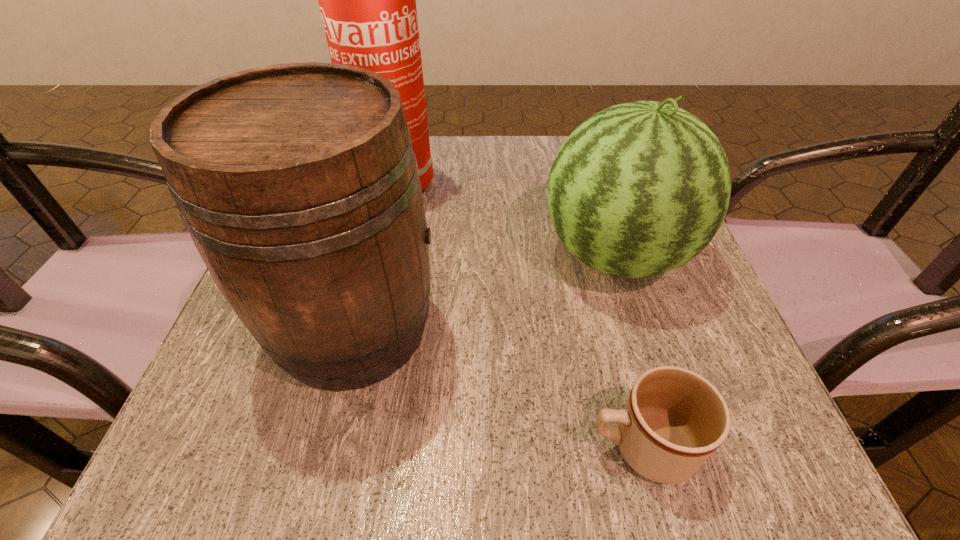
You are a GUI agent. You are given a task and a screenshot of the screen. Output one action in this format:
    pyautogui.click(x=<x>, y=<y>)
    Task: Click on the free space located 0.160m on the side of the shortest object with the handle
    
    Given the screenshot: What is the action you would take?
    pyautogui.click(x=457, y=446)

Locate an element on the screen. free space located on the side of the shortest object with the handle is located at coordinates (313, 446).

I want to click on object at the far edge, so click(367, 0).

Identify the location of object that is at the near edge. The width and height of the screenshot is (960, 540). click(x=673, y=420).

The width and height of the screenshot is (960, 540). What are the coordinates of `fire extinguisher positioned at the left edge` in the screenshot? It's located at (367, 0).

You are a GUI agent. You are given a task and a screenshot of the screen. Output one action in this format:
    pyautogui.click(x=<x>, y=<y>)
    Task: Click on the cider that is at the left edge
    Image resolution: width=960 pixels, height=540 pixels.
    Given the screenshot: What is the action you would take?
    pyautogui.click(x=297, y=182)

Locate an element on the screen. The height and width of the screenshot is (540, 960). watermelon at the right edge is located at coordinates (639, 189).

At what (x,y) coordinates should I click in order to perform the action: click on mug that is at the right edge. Please return your answer as a coordinate pair (x, y). Looking at the image, I should click on (673, 420).

This screenshot has height=540, width=960. In order to click on object that is at the far left corner in this screenshot , I will do `click(367, 0)`.

The image size is (960, 540). Identify the location of object located in the near right corner section of the desktop. (673, 420).